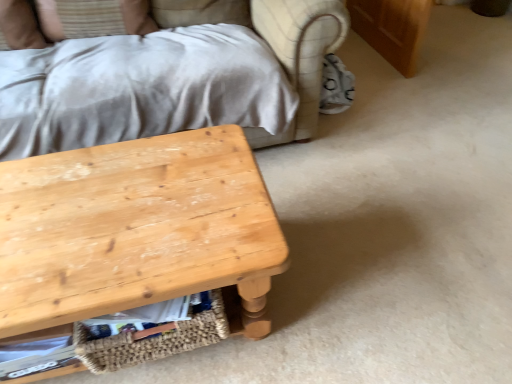
Question: Can you confirm if white fabric pillow at upper left is smaller than natural wood table at lower left?

Choices:
 (A) no
 (B) yes

Answer: (B)

Question: Is white fabric pillow at upper left at the right side of natural wood table at lower left?

Choices:
 (A) no
 (B) yes

Answer: (A)

Question: Is white fabric pillow at upper left positioned with its back to natural wood table at lower left?

Choices:
 (A) no
 (B) yes

Answer: (A)

Question: From the image's perspective, is white fabric pillow at upper left over natural wood table at lower left?

Choices:
 (A) yes
 (B) no

Answer: (A)

Question: From a real-world perspective, does white fabric pillow at upper left sit lower than natural wood table at lower left?

Choices:
 (A) no
 (B) yes

Answer: (A)

Question: Is white fabric pillow at upper left wider than natural wood table at lower left?

Choices:
 (A) yes
 (B) no

Answer: (B)

Question: Can you confirm if woven straw basket at lower center is smaller than natural wood table at lower left?

Choices:
 (A) no
 (B) yes

Answer: (B)

Question: Is woven straw basket at lower center completely or partially outside of natural wood table at lower left?

Choices:
 (A) yes
 (B) no

Answer: (B)

Question: Considering the relative positions of woven straw basket at lower center and natural wood table at lower left in the image provided, is woven straw basket at lower center to the right of natural wood table at lower left from the viewer's perspective?

Choices:
 (A) yes
 (B) no

Answer: (A)

Question: Is there a large distance between woven straw basket at lower center and natural wood table at lower left?

Choices:
 (A) yes
 (B) no

Answer: (B)

Question: From the image's perspective, does woven straw basket at lower center appear lower than natural wood table at lower left?

Choices:
 (A) yes
 (B) no

Answer: (A)

Question: Is woven straw basket at lower center wider than natural wood table at lower left?

Choices:
 (A) yes
 (B) no

Answer: (B)

Question: Is woven straw basket at lower center in contact with white fabric pillow at upper left?

Choices:
 (A) yes
 (B) no

Answer: (B)